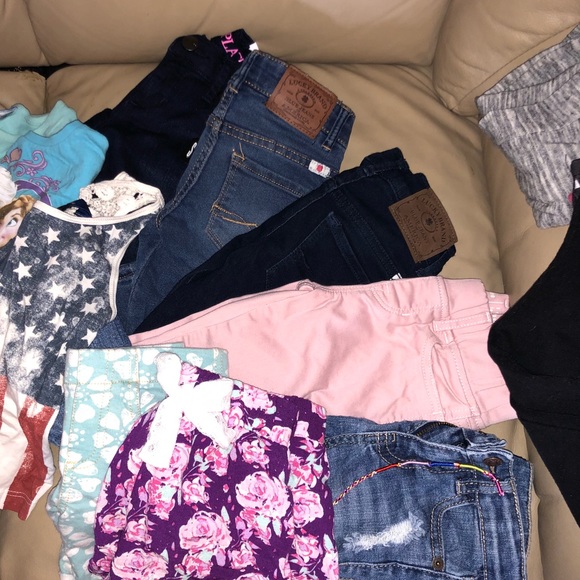
The image size is (580, 580). What are the coordinates of `sofa cushioning` in the screenshot? It's located at coord(495,23), coord(343,24), coord(20,42), coord(21,86), coord(97,87), coord(511,202).